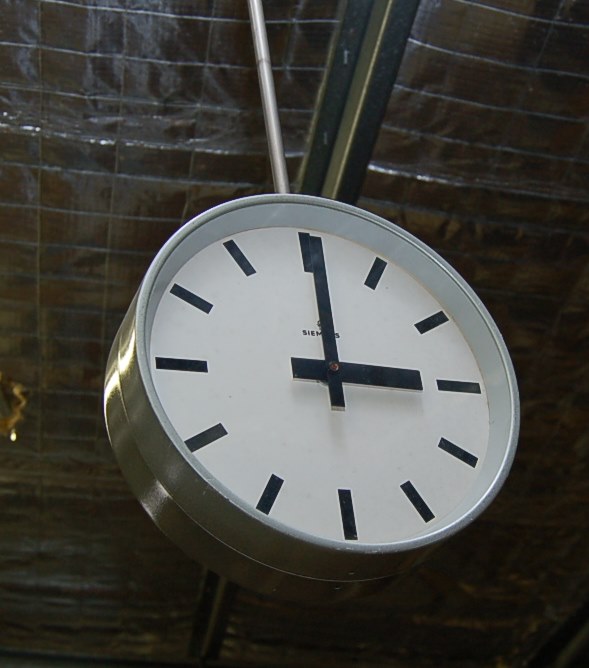
Find the location of a particular element. silver frame is located at coordinates (188, 452).